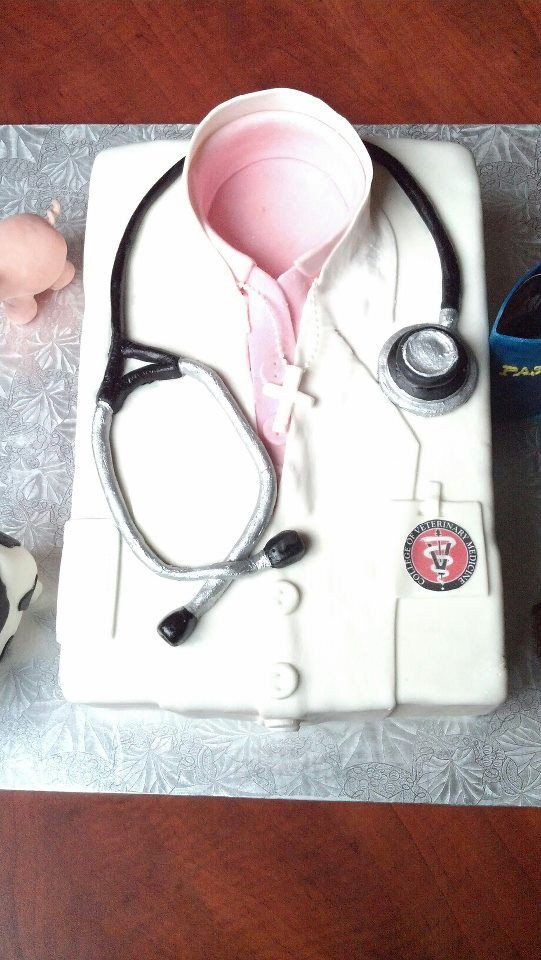
The height and width of the screenshot is (960, 541). In order to click on table in this screenshot , I will do pos(321,870).